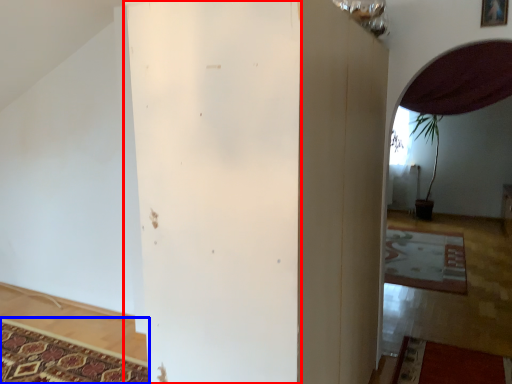
Question: Among these objects, which one is farthest to the camera, pillar (highlighted by a red box) or mat (highlighted by a blue box)?

Choices:
 (A) pillar
 (B) mat

Answer: (B)